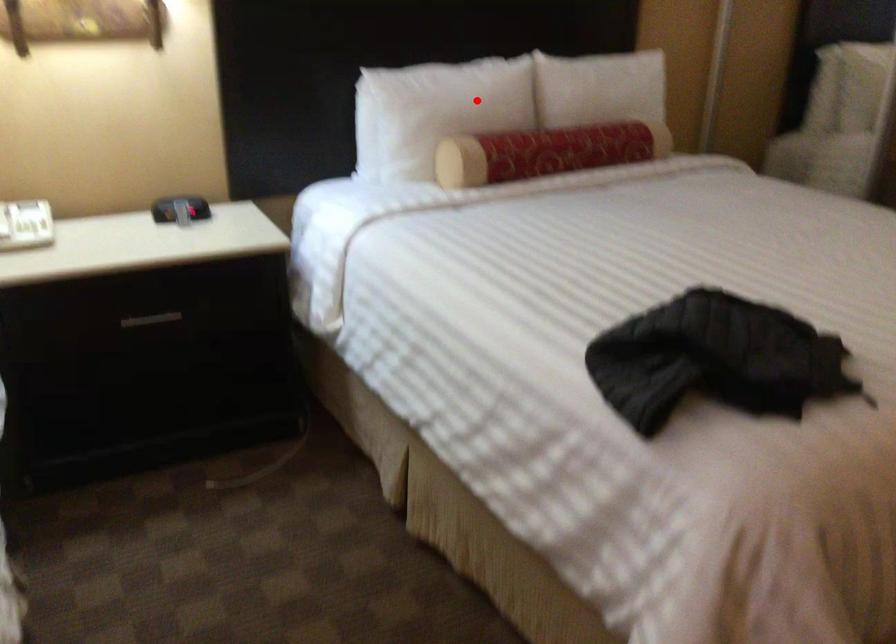
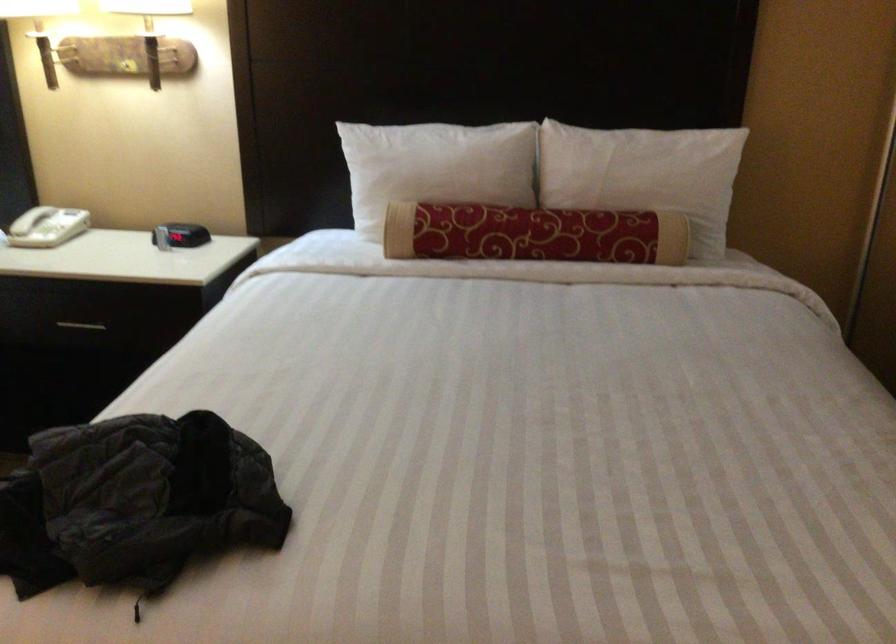
Find the pixel in the second image that matches the highlighted location in the first image.

(435, 167)